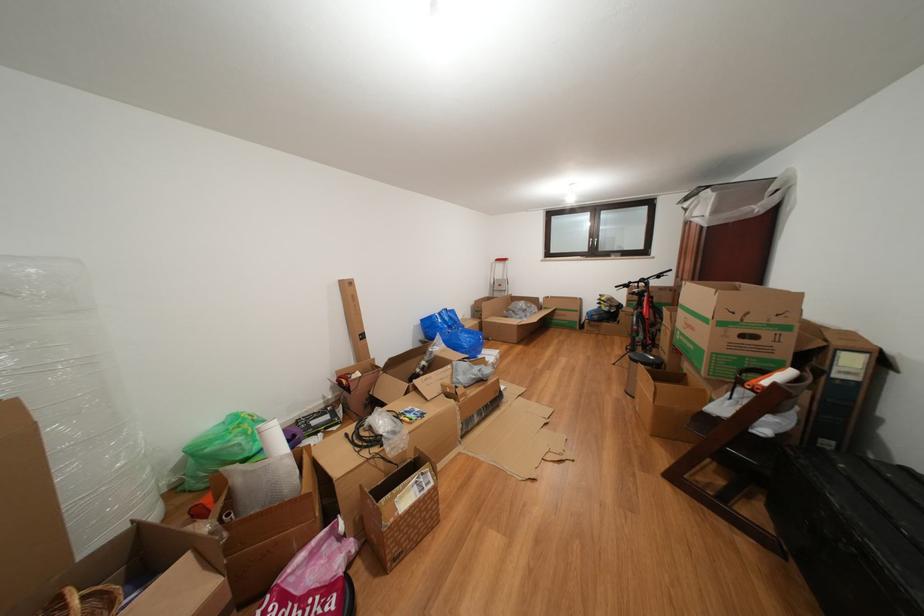
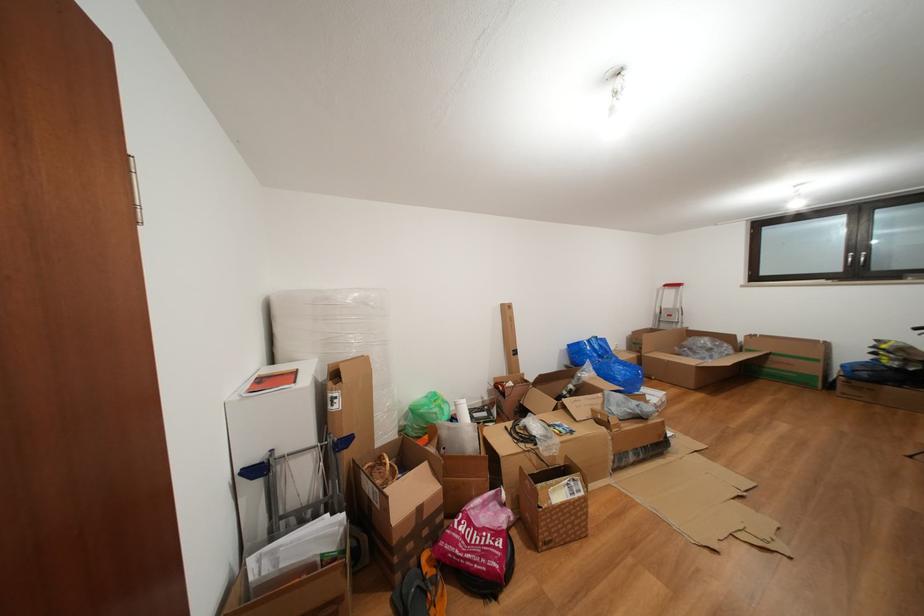
The point at (602, 240) is marked in the first image. Where is the corresponding point in the second image?

(866, 252)